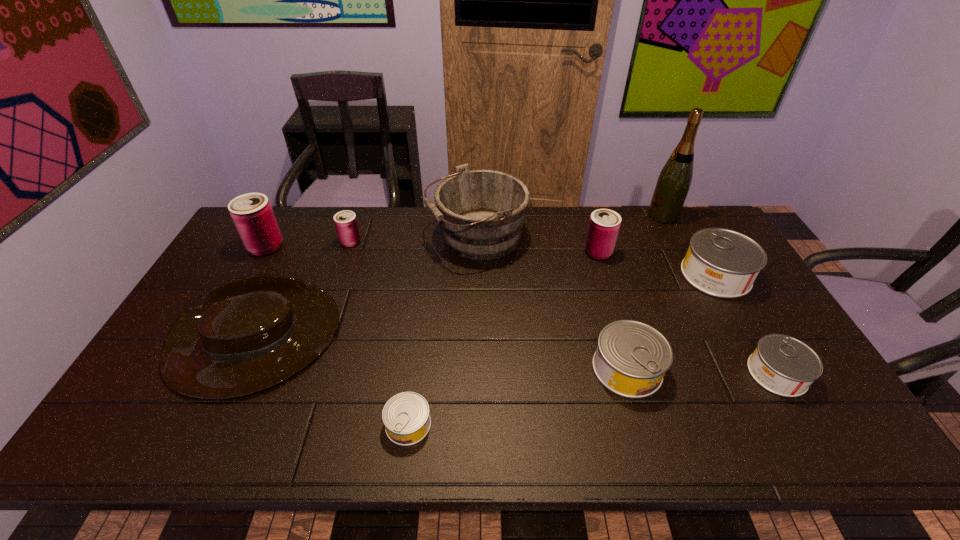
Locate an element on the screen. The height and width of the screenshot is (540, 960). free area in between the nearest silver can and the farthest silver can is located at coordinates (562, 350).

You are a GUI agent. You are given a task and a screenshot of the screen. Output one action in this format:
    pyautogui.click(x=<x>, y=<y>)
    Task: Click on the free area in between the farthest silver can and the second biggest silver can
    
    Given the screenshot: What is the action you would take?
    pyautogui.click(x=671, y=322)

Where is `vacant space in between the leftmost pink can and the shortest can`? The height and width of the screenshot is (540, 960). vacant space in between the leftmost pink can and the shortest can is located at coordinates tap(337, 335).

I want to click on free point between the cowboy hat and the third silver can from right to left, so click(440, 356).

Identify the location of free space between the wine bucket and the shortest object. The width and height of the screenshot is (960, 540). (443, 331).

Identify the location of free spot between the wine bucket and the second tallest can. (538, 245).

Where is `vacant area that lies between the leftmost silver can and the cowboy hat`? The height and width of the screenshot is (540, 960). vacant area that lies between the leftmost silver can and the cowboy hat is located at coordinates (330, 384).

Identify the location of vacant space in between the second biggest silver can and the sixth can from right to left. (489, 305).

Point out which object is positioned as the eighth nearest to the second silver can from left to right. Please provide its 2D coordinates. Your answer should be formatted as a tuple, i.e. [(x, y)], where the tuple contains the x and y coordinates of a point satisfying the conditions above.

[(346, 224)]

Find the location of `the second closest object relative to the biggest silver can`. the second closest object relative to the biggest silver can is located at coordinates (785, 366).